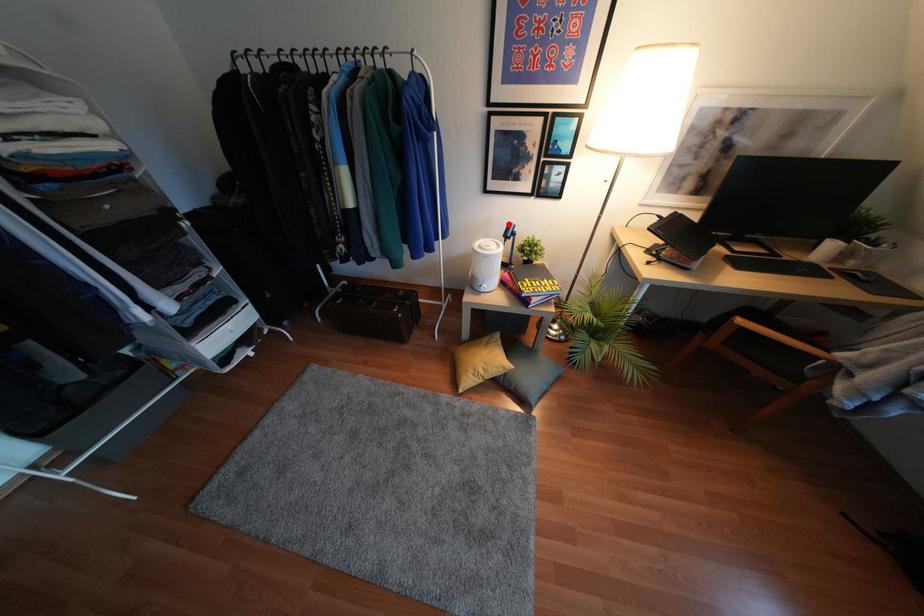
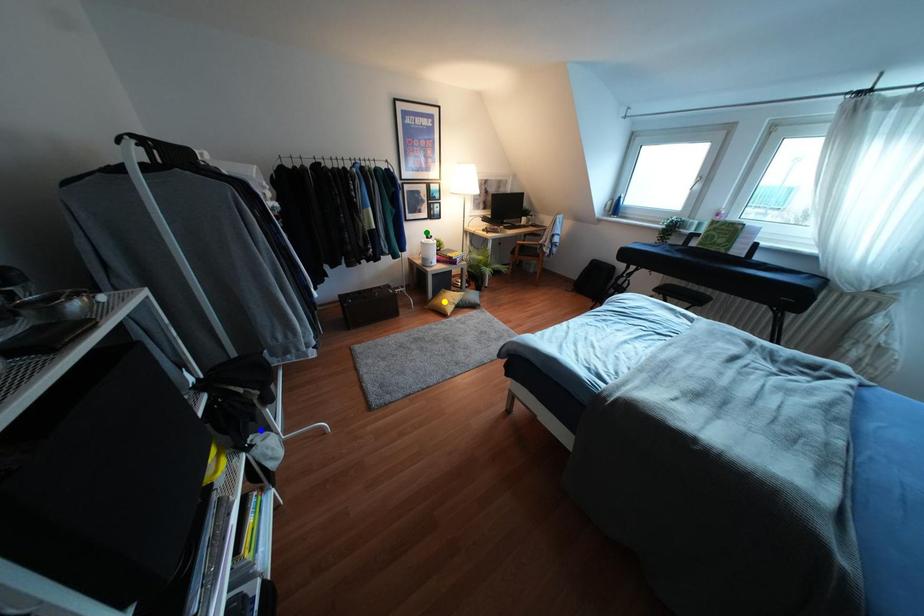
Question: I am providing you with two images of the same scene from different viewpoints. A red point is marked on the first image. You are given multiple points on the second image. Which point in image 2 is actually the same real-world point as the red point in image 1?

Choices:
 (A) blue point
 (B) green point
 (C) yellow point

Answer: (B)